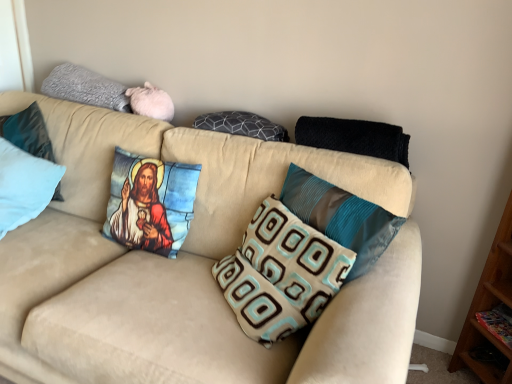
Question: Does beige fabric couch at center have a greater height compared to black knitted blanket at upper right, arranged as the 8th pillow when viewed from the left?

Choices:
 (A) no
 (B) yes

Answer: (B)

Question: Is beige fabric couch at center bigger than black knitted blanket at upper right, arranged as the 1th pillow when viewed from the right?

Choices:
 (A) yes
 (B) no

Answer: (A)

Question: Considering the relative positions of beige fabric couch at center and black knitted blanket at upper right, arranged as the 8th pillow when viewed from the left, in the image provided, is beige fabric couch at center to the left of black knitted blanket at upper right, arranged as the 8th pillow when viewed from the left, from the viewer's perspective?

Choices:
 (A) yes
 (B) no

Answer: (A)

Question: Can you confirm if beige fabric couch at center is smaller than black knitted blanket at upper right, arranged as the 1th pillow when viewed from the right?

Choices:
 (A) no
 (B) yes

Answer: (A)

Question: Is beige fabric couch at center turned away from black knitted blanket at upper right, arranged as the 8th pillow when viewed from the left?

Choices:
 (A) yes
 (B) no

Answer: (B)

Question: Is light blue fabric pillow at left, which appears as the seventh pillow when viewed from the right, wider or thinner than brown and teal patterned pillow at center, positioned as the sixth pillow in left-to-right order?

Choices:
 (A) thin
 (B) wide

Answer: (A)

Question: Is light blue fabric pillow at left, which appears as the seventh pillow when viewed from the right, in front of or behind brown and teal patterned pillow at center, the 3th pillow in the right-to-left sequence, in the image?

Choices:
 (A) behind
 (B) front

Answer: (A)

Question: Considering the positions of point (36, 125) and point (313, 246), is point (36, 125) closer or farther from the camera than point (313, 246)?

Choices:
 (A) farther
 (B) closer

Answer: (A)

Question: Considering the relative positions of light blue fabric pillow at left, which appears as the seventh pillow when viewed from the right, and brown and teal patterned pillow at center, the 3th pillow in the right-to-left sequence, in the image provided, is light blue fabric pillow at left, which appears as the seventh pillow when viewed from the right, to the left or to the right of brown and teal patterned pillow at center, the 3th pillow in the right-to-left sequence,?

Choices:
 (A) left
 (B) right

Answer: (A)

Question: Looking at their shapes, would you say light blue fabric pillow at left, the 8th pillow when ordered from right to left, is wider or thinner than dark gray textured pillow at center, the 5th pillow positioned from the left?

Choices:
 (A) thin
 (B) wide

Answer: (B)

Question: In terms of size, does light blue fabric pillow at left, the 8th pillow when ordered from right to left, appear bigger or smaller than dark gray textured pillow at center, the 5th pillow positioned from the left?

Choices:
 (A) big
 (B) small

Answer: (A)

Question: Would you say light blue fabric pillow at left, the 8th pillow when ordered from right to left, is to the left or to the right of dark gray textured pillow at center, which is the 4th pillow from right to left, in the picture?

Choices:
 (A) left
 (B) right

Answer: (A)

Question: In terms of height, does light blue fabric pillow at left, the first pillow from the left, look taller or shorter compared to dark gray textured pillow at center, which is the 4th pillow from right to left?

Choices:
 (A) tall
 (B) short

Answer: (A)

Question: In the image, is black knitted blanket at upper right, arranged as the 1th pillow when viewed from the right, on the left side or the right side of light blue fabric pillow at left, which is the 2th pillow from left to right?

Choices:
 (A) right
 (B) left

Answer: (A)

Question: In terms of width, does black knitted blanket at upper right, arranged as the 8th pillow when viewed from the left, look wider or thinner when compared to light blue fabric pillow at left, which is the 2th pillow from left to right?

Choices:
 (A) thin
 (B) wide

Answer: (B)